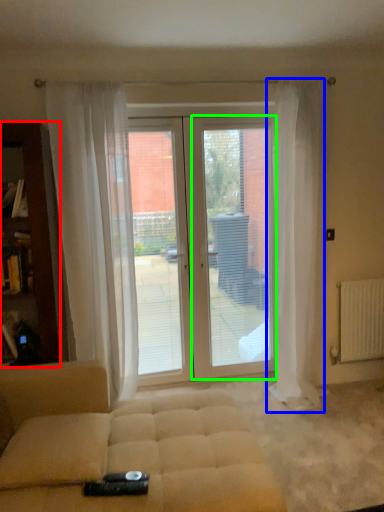
Question: Based on their relative distances, which object is farther from cabinetry (highlighted by a red box)? Choose from curtain (highlighted by a blue box) and screen door (highlighted by a green box).

Choices:
 (A) curtain
 (B) screen door

Answer: (A)